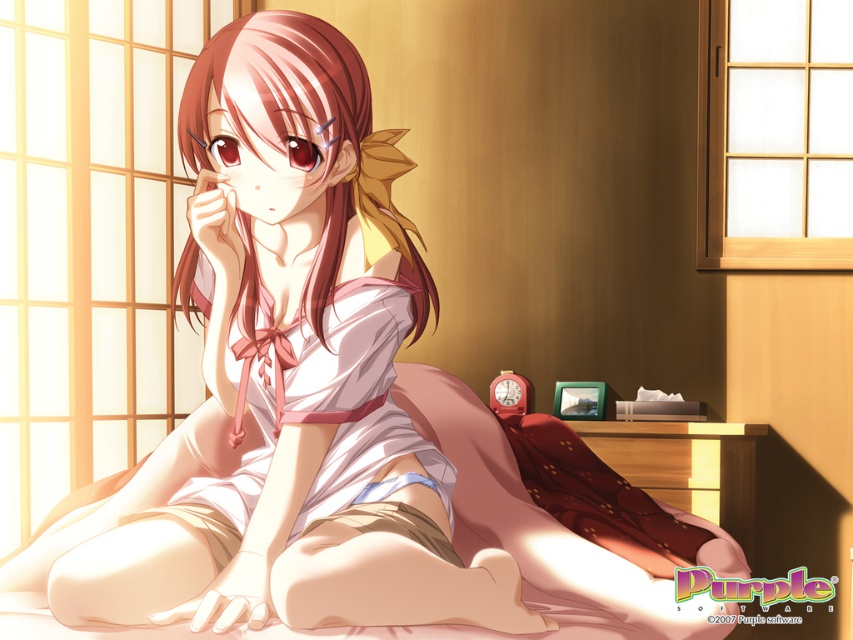
You are an interior designer assessing the materials in the room. The smooth white dress at center and the soft pink fabric bed at lower center are both in view. Which object has a material that is less thick?

The smooth white dress at center is thinner than the soft pink fabric bed at lower center, so the smooth white dress at center has a material that is less thick.